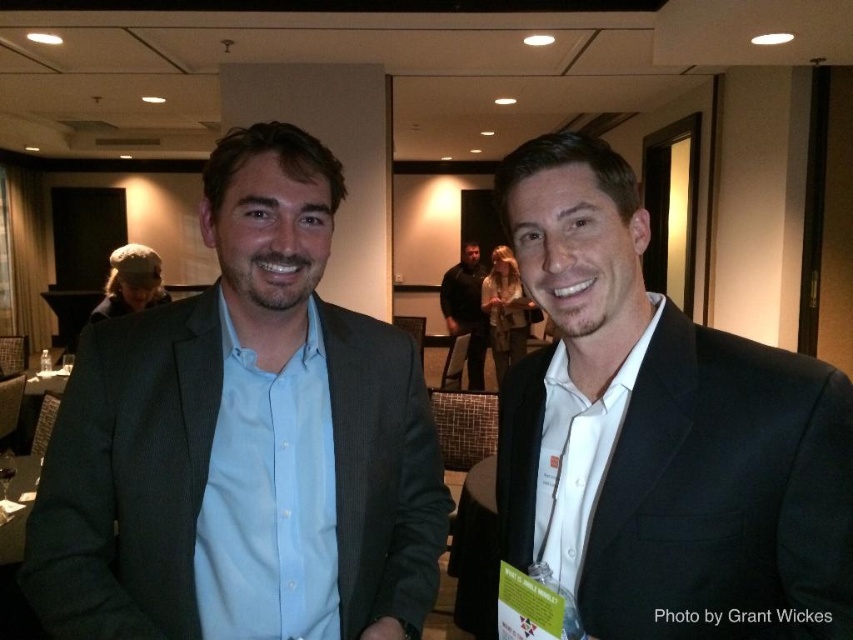
You are organizing a photo shoot and need to place two models wearing matte black suits in a narrow corridor. The corridor is only wide enough for one person. Given the space constraints, which model should you choose between the matte black suit at left and the matte black suit at right?

The matte black suit at right should be chosen because the matte black suit at left is wider, making the narrower corridor unsuitable for the wider model.